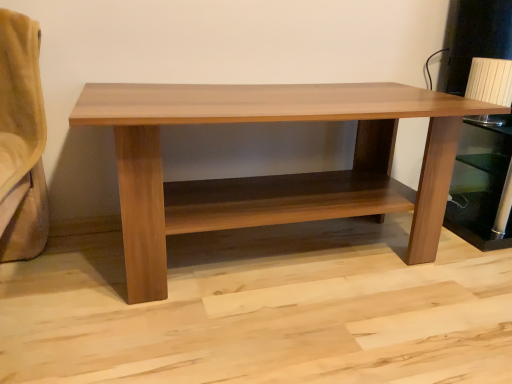
Question: Does point (495, 147) appear closer or farther from the camera than point (159, 286)?

Choices:
 (A) farther
 (B) closer

Answer: (A)

Question: Is brown wood shelf at right in front of or behind wooden table at center in the image?

Choices:
 (A) behind
 (B) front

Answer: (A)

Question: Considering the relative positions of brown wood shelf at right and wooden table at center in the image provided, is brown wood shelf at right to the left or to the right of wooden table at center?

Choices:
 (A) right
 (B) left

Answer: (A)

Question: Based on their positions, is wooden table at center located to the left or right of brown wood shelf at right?

Choices:
 (A) left
 (B) right

Answer: (A)

Question: Does point (368, 100) appear closer or farther from the camera than point (498, 172)?

Choices:
 (A) farther
 (B) closer

Answer: (B)

Question: Considering the positions of wooden table at center and brown wood shelf at right in the image, is wooden table at center wider or thinner than brown wood shelf at right?

Choices:
 (A) thin
 (B) wide

Answer: (B)

Question: In terms of height, does wooden table at center look taller or shorter compared to brown wood shelf at right?

Choices:
 (A) short
 (B) tall

Answer: (B)